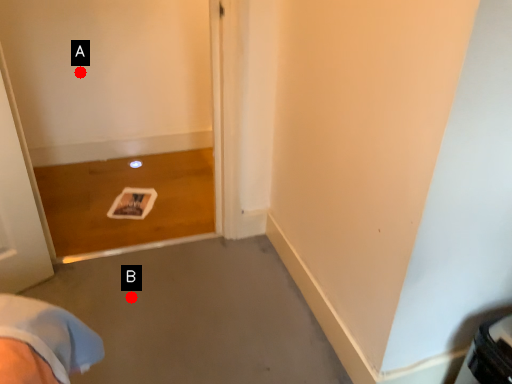
Question: Two points are circled on the image, labeled by A and B beside each circle. Which point is closer to the camera?

Choices:
 (A) A is closer
 (B) B is closer

Answer: (B)